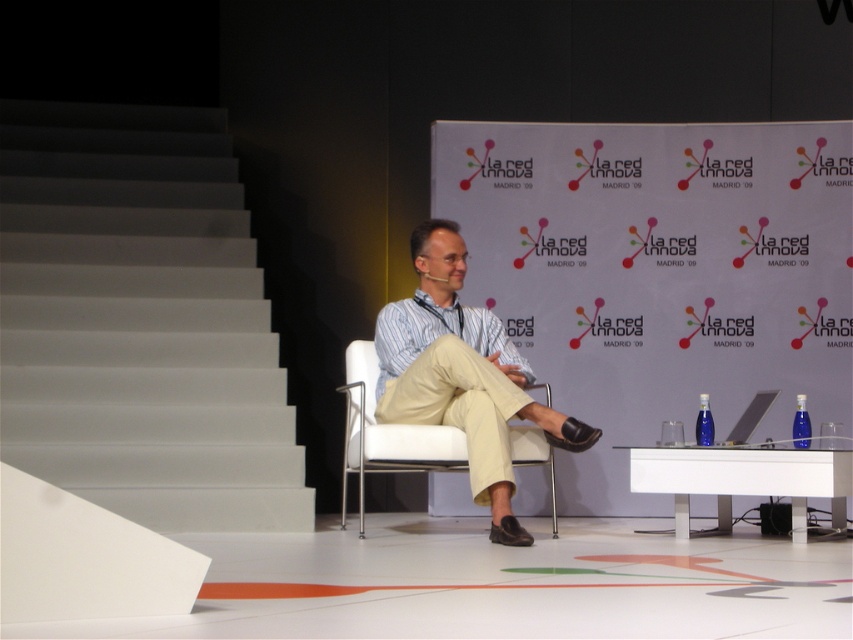
You are organizing a photo shoot in this conference room and need to place a large equipment box between the white smooth stairs at left and the white fabric chair at center. The box requires a minimum width of 1.2 meters to fit. Based on the scene, can the space between them accommodate the box?

The white smooth stairs at left are wider than the white fabric chair at center. However, without specific measurements of the space between them, it is impossible to determine if the 1.2 meter requirement is met. Consider measuring the actual distance before placing the box.

You are an attendee at the conference and want to move from the white smooth stairs at left to the light beige cotton pants at center. Is the path clear?

The white smooth stairs at left is positioned over light beige cotton pants at center, so the path is not clear as the stairs are above the pants.

You are an event organizer at La Red Innova in Madrid. You need to determine if the light beige cotton pants at center can be placed on the white fabric chair at center without falling off. Based on their heights, can you confirm this?

The light beige cotton pants at center is much taller than the white fabric chair at center, so placing the pants on the chair would likely cause them to fall off due to their greater height.